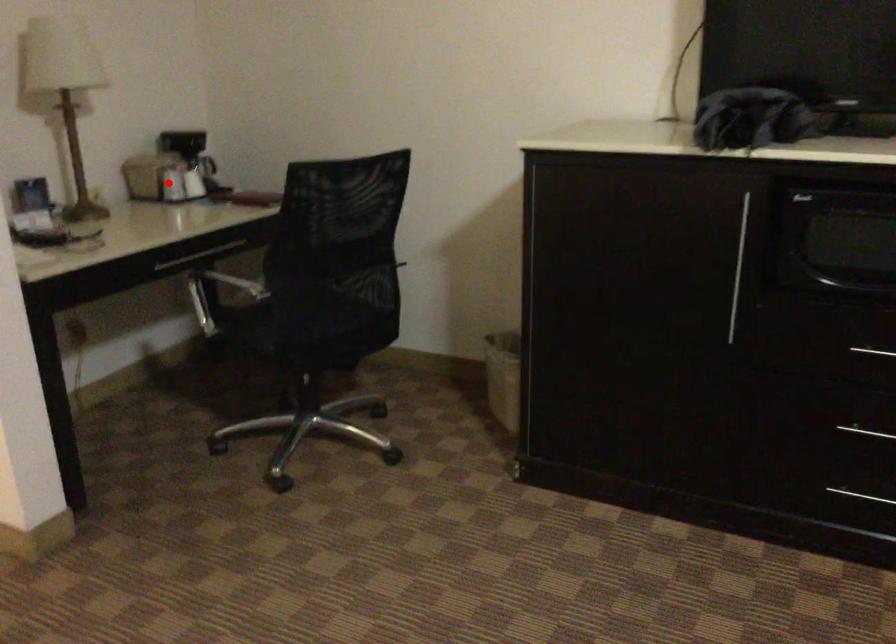
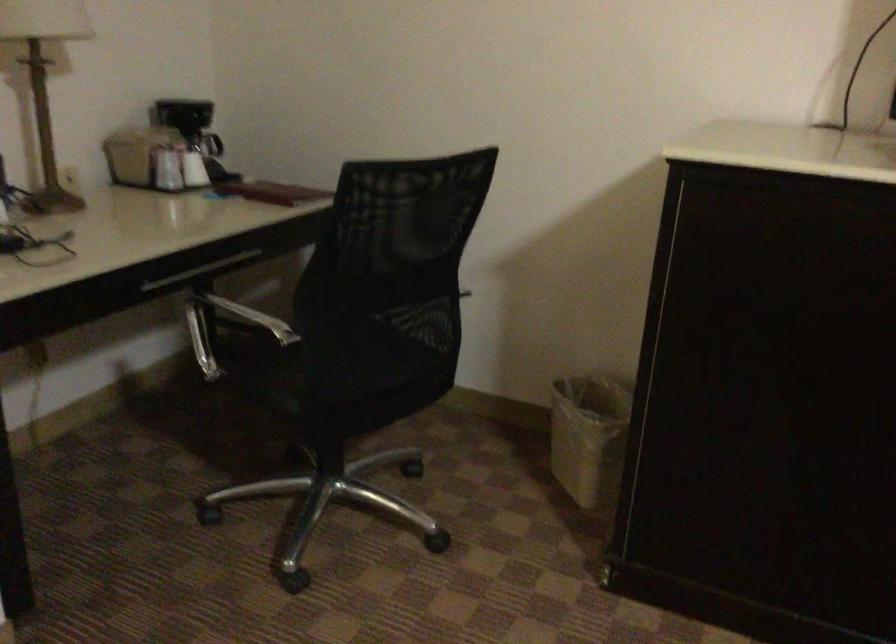
The point at the highlighted location is marked in the first image. Where is the corresponding point in the second image?

(165, 169)